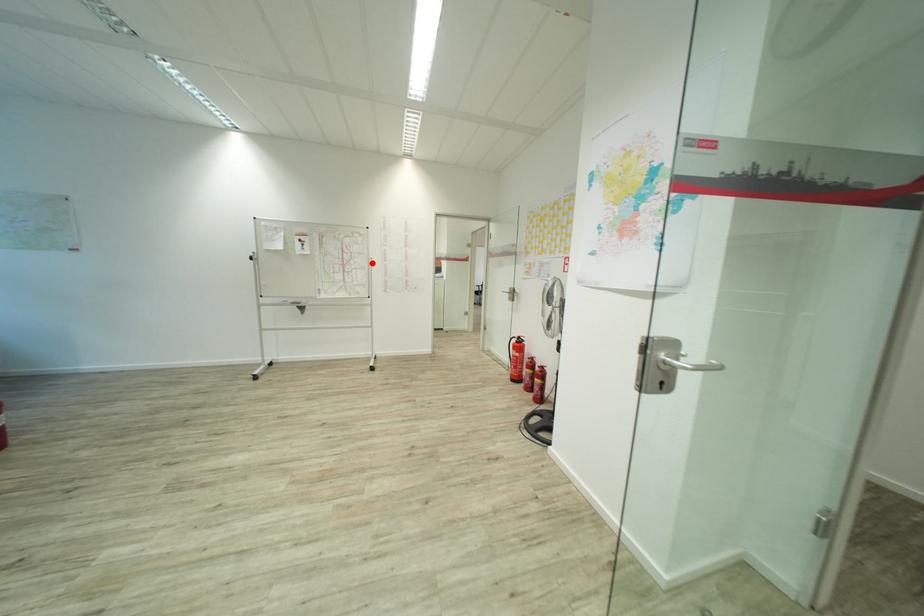
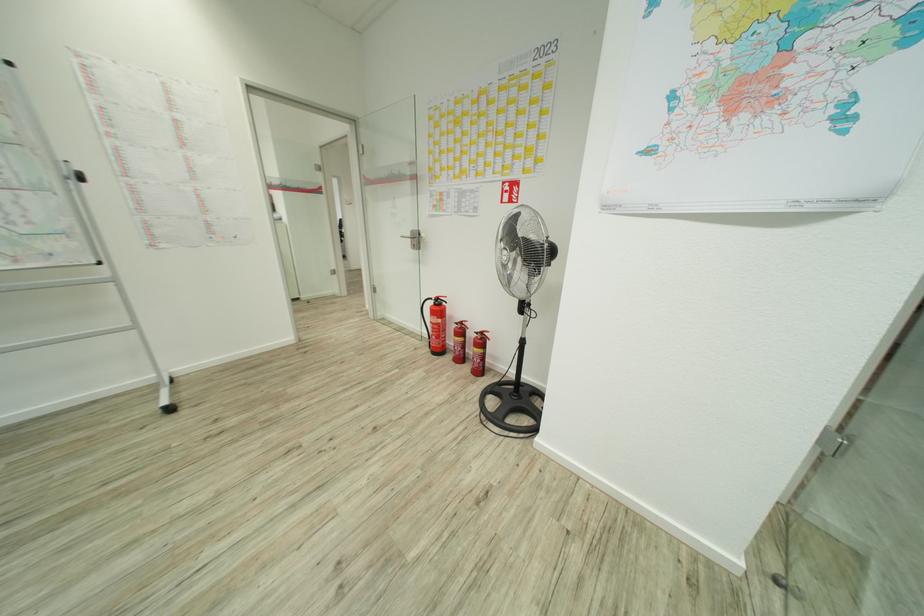
Question: I am providing you with two images of the same scene from different viewpoints. A red point is shown in image1. For the corresponding object point in image2, is it positioned nearer or farther from the camera?

Choices:
 (A) Nearer
 (B) Farther

Answer: (B)